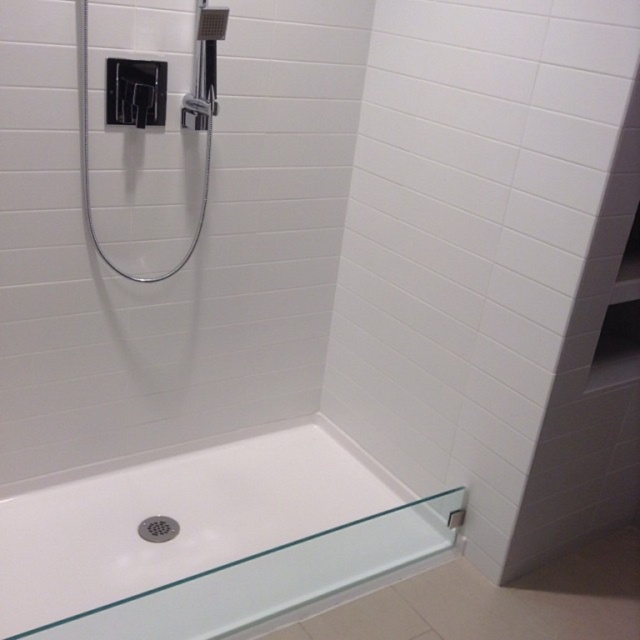
Where is `black matte shower door at upper left`? black matte shower door at upper left is located at coordinates (180, 116).

Is black matte shower door at upper left wider than matte chrome showerhead at upper left?

Indeed, black matte shower door at upper left has a greater width compared to matte chrome showerhead at upper left.

Who is more distant from viewer, (125, 122) or (204, 52)?

The point (204, 52) is more distant.

Image resolution: width=640 pixels, height=640 pixels. Find the location of `black matte shower door at upper left`. black matte shower door at upper left is located at coordinates (180, 116).

Does point (24, 582) come farther from viewer compared to point (195, 81)?

No.

Who is lower down, white glossy bathtub at lower center or matte chrome showerhead at upper left?

white glossy bathtub at lower center is below.

Does point (58, 602) come behind point (196, 104)?

No, it is not.

Where is `white glossy bathtub at lower center`? This screenshot has height=640, width=640. white glossy bathtub at lower center is located at coordinates (211, 540).

Does point (140, 605) come closer to viewer compared to point (83, 65)?

Yes, it is in front of point (83, 65).

Image resolution: width=640 pixels, height=640 pixels. I want to click on white glossy bathtub at lower center, so click(211, 540).